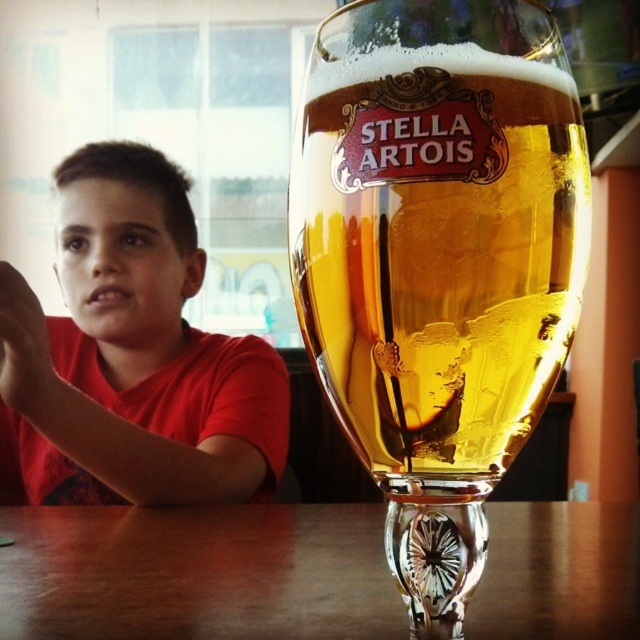
Question: Which object is closer to the camera taking this photo?

Choices:
 (A) wooden table at lower center
 (B) clear glass stella artois beer glass at center

Answer: (B)

Question: Which object is positioned farthest from the wooden table at lower center?

Choices:
 (A) clear glass stella artois beer glass at center
 (B) matte red shirt at left

Answer: (A)

Question: Is clear glass stella artois beer glass at center smaller than wooden table at lower center?

Choices:
 (A) yes
 (B) no

Answer: (A)

Question: From the image, what is the correct spatial relationship of matte red shirt at left in relation to wooden table at lower center?

Choices:
 (A) above
 (B) below

Answer: (A)

Question: Considering the relative positions of matte red shirt at left and wooden table at lower center in the image provided, where is matte red shirt at left located with respect to wooden table at lower center?

Choices:
 (A) right
 (B) left

Answer: (B)

Question: Which of these objects is positioned closest to the wooden table at lower center?

Choices:
 (A) clear glass stella artois beer glass at center
 (B) matte red shirt at left

Answer: (B)